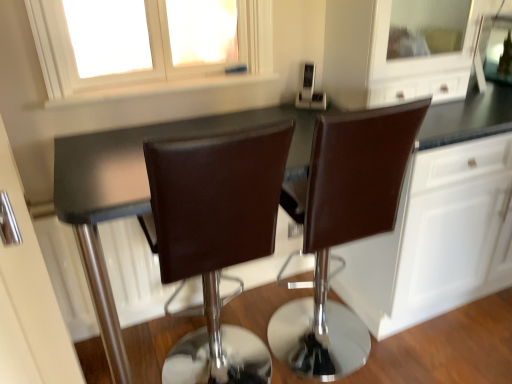
Question: Does satin silver toaster at upper center turn towards white matte window at upper center?

Choices:
 (A) yes
 (B) no

Answer: (B)

Question: Is satin silver toaster at upper center far away from white matte window at upper center?

Choices:
 (A) no
 (B) yes

Answer: (A)

Question: Is satin silver toaster at upper center taller than white matte window at upper center?

Choices:
 (A) yes
 (B) no

Answer: (B)

Question: Can white matte window at upper center be found inside satin silver toaster at upper center?

Choices:
 (A) yes
 (B) no

Answer: (B)

Question: Considering the relative sizes of satin silver toaster at upper center and white matte window at upper center in the image provided, is satin silver toaster at upper center bigger than white matte window at upper center?

Choices:
 (A) yes
 (B) no

Answer: (B)

Question: Would you say satin silver toaster at upper center is outside white matte window at upper center?

Choices:
 (A) yes
 (B) no

Answer: (A)

Question: Is white glossy cabinetry at right to the left of brown leather chair at center, which is counted as the first chair, starting from the right, from the viewer's perspective?

Choices:
 (A) no
 (B) yes

Answer: (A)

Question: Is white glossy cabinetry at right wider than brown leather chair at center, which is counted as the first chair, starting from the right?

Choices:
 (A) no
 (B) yes

Answer: (B)

Question: Does white glossy cabinetry at right appear on the right side of brown leather chair at center, positioned as the 2th chair in left-to-right order?

Choices:
 (A) no
 (B) yes

Answer: (B)

Question: Does white glossy cabinetry at right have a larger size compared to brown leather chair at center, which is counted as the first chair, starting from the right?

Choices:
 (A) no
 (B) yes

Answer: (B)

Question: From the image's perspective, would you say white glossy cabinetry at right is shown under brown leather chair at center, which is counted as the first chair, starting from the right?

Choices:
 (A) no
 (B) yes

Answer: (A)

Question: Is white glossy cabinetry at right positioned behind brown leather chair at center, which is counted as the first chair, starting from the right?

Choices:
 (A) yes
 (B) no

Answer: (A)

Question: Is brown leather chair at center, which is counted as the first chair, starting from the right, wider than satin silver toaster at upper center?

Choices:
 (A) yes
 (B) no

Answer: (A)